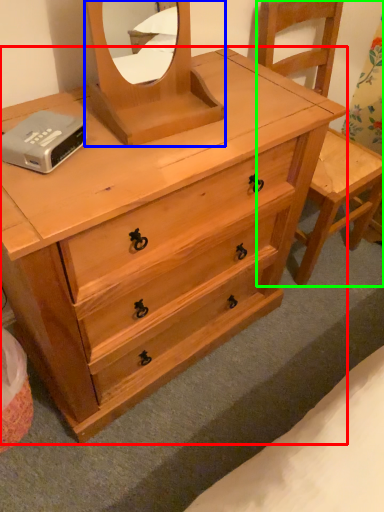
Question: Based on their relative distances, which object is farther from chest of drawers (highlighted by a red box)? Choose from mirror (highlighted by a blue box) and armchair (highlighted by a green box).

Choices:
 (A) mirror
 (B) armchair

Answer: (B)